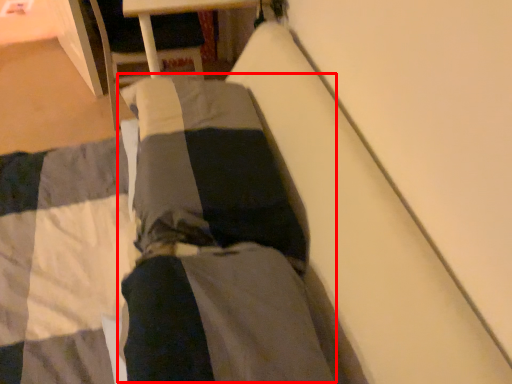
Question: From the image's perspective, where is couple (annotated by the red box) located in relation to pants in the image?

Choices:
 (A) above
 (B) below

Answer: (A)